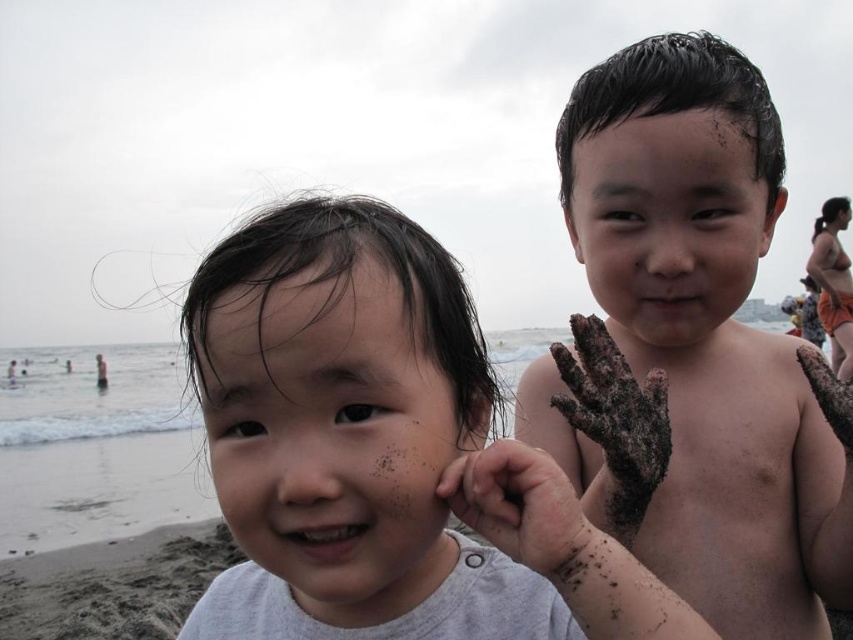
You are a photographer trying to capture a closeup shot of the smooth skin child at center. The camera you are using has a minimum focusing distance of 28 inches. Will you be able to take the photo without moving closer?

The smooth skin child at center is 27.04 inches from the camera, which is within the minimum focusing distance of 28 inches. Therefore, you can take the photo without moving closer.

You are a photographer at the beach and want to ensure both children are in focus in your shot. Given that the smooth skin child at center is closer to you, would adjusting the camera focus to the dark brown skin at right help capture both clearly?

The smooth skin child at center is larger in size than dark brown skin at right, which suggests they are closer to you. To capture both in focus, you should focus on the smooth skin child at center since they are nearer, and the dark brown skin at right will also be in focus if within the depth of field.

Looking at the beach scene with the smooth skin child at center and the dark brown skin at right, which child is positioned closer to the left side?

The smooth skin child at center is positioned to the left of the dark brown skin at right, so the smooth skin child at center is closer to the left side.